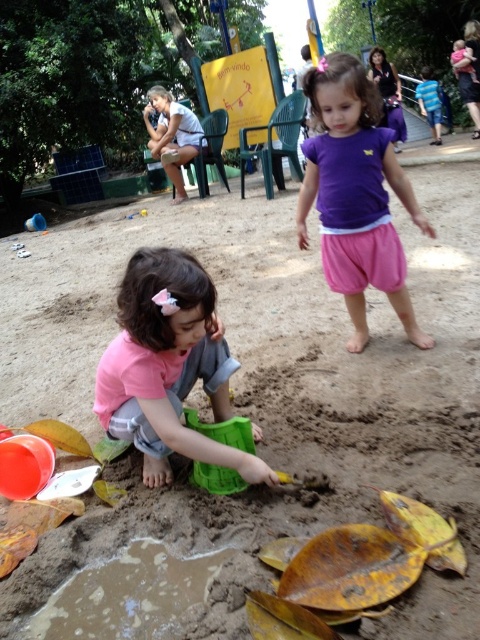
Measure the distance from pink matte shirt at lower left to purple cotton shirt at center.

The distance of pink matte shirt at lower left from purple cotton shirt at center is 36.87 inches.

Which is in front, point (143, 336) or point (406, 188)?

Point (143, 336) is more forward.

Locate an element on the screen. This screenshot has height=640, width=480. pink matte shirt at lower left is located at coordinates (168, 365).